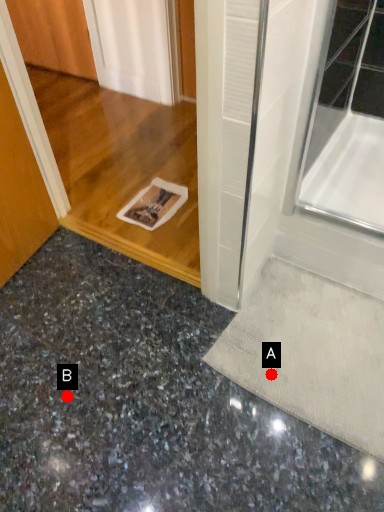
Question: Two points are circled on the image, labeled by A and B beside each circle. Which point appears closest to the camera in this image?

Choices:
 (A) A is closer
 (B) B is closer

Answer: (B)